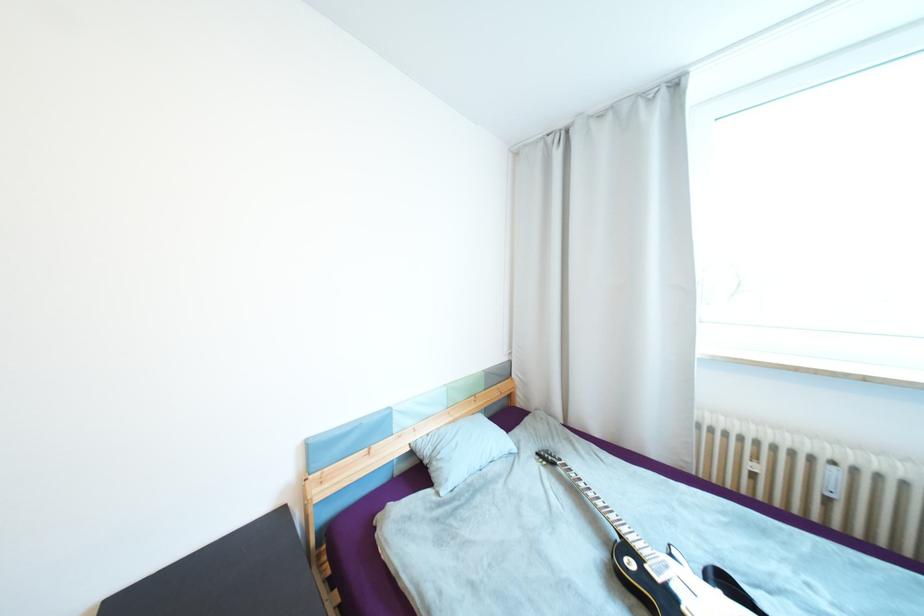
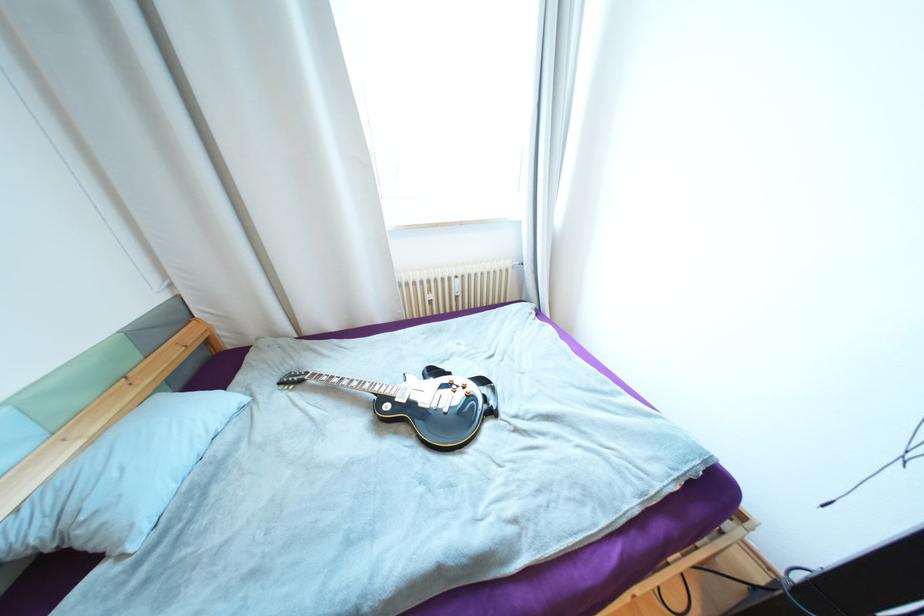
Find the pixel in the second image that matches point 636,539 in the first image.

(387, 391)